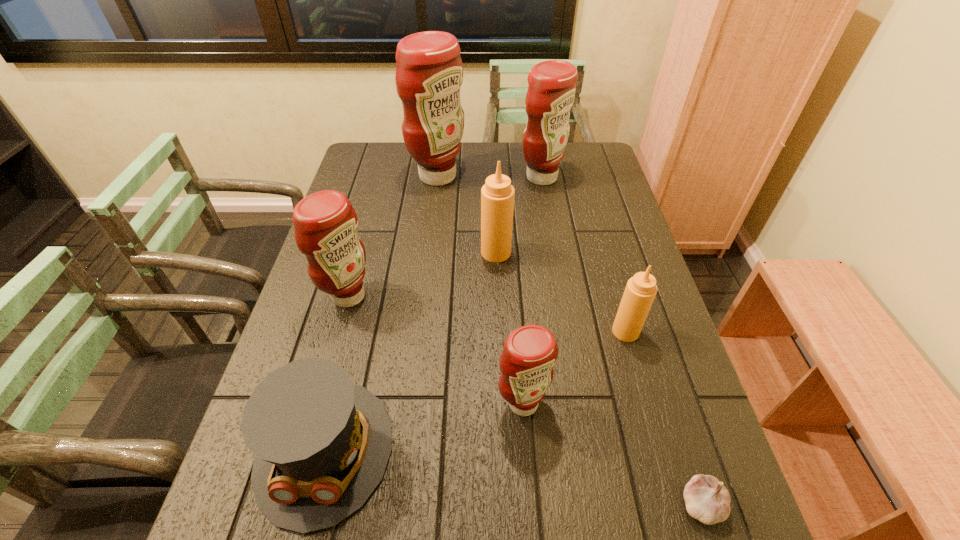
The height and width of the screenshot is (540, 960). What are the coordinates of `the right tan condiment` in the screenshot? It's located at (641, 289).

What are the coordinates of `the smaller tan condiment` in the screenshot? It's located at (641, 289).

This screenshot has height=540, width=960. What are the coordinates of `dress hat` in the screenshot? It's located at (x=321, y=444).

The image size is (960, 540). I want to click on white garlic, so click(707, 499).

Find the location of a particular element. garlic is located at coordinates (707, 499).

Find the location of `free space located 0.100m on the front of the biggest red condiment`. free space located 0.100m on the front of the biggest red condiment is located at coordinates (434, 211).

You are a GUI agent. You are given a task and a screenshot of the screen. Output one action in this format:
    pyautogui.click(x=<x>, y=<y>)
    Task: Click on the free region located 0.080m on the right of the second tallest object
    
    Given the screenshot: What is the action you would take?
    pyautogui.click(x=587, y=178)

Image resolution: width=960 pixels, height=540 pixels. What are the coordinates of `vacant space located 0.230m on the left of the sixth nearest object` in the screenshot? It's located at (401, 252).

Identify the location of free location located on the back of the third nearest condiment. (369, 224).

Find the location of a particular element. The width and height of the screenshot is (960, 540). vacant area located on the front of the nearest condiment is located at coordinates (532, 523).